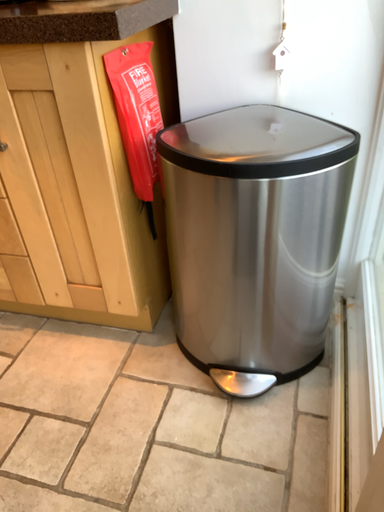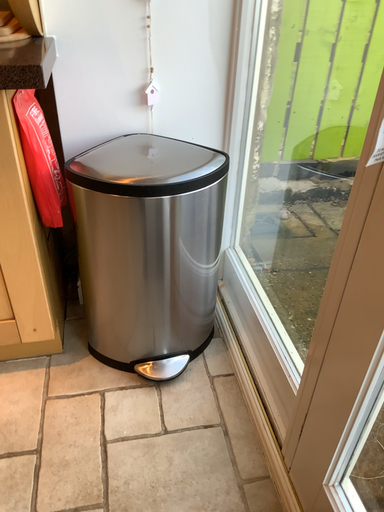
Question: Which way did the camera rotate in the video?

Choices:
 (A) rotated left
 (B) rotated right

Answer: (B)